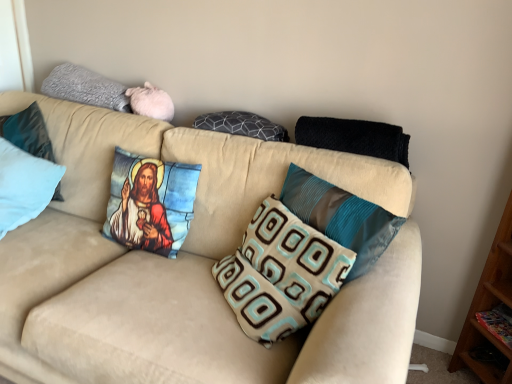
Image resolution: width=512 pixels, height=384 pixels. Describe the element at coordinates (341, 217) in the screenshot. I see `teal fabric pillow at center, which is the second pillow in right-to-left order` at that location.

What do you see at coordinates (29, 132) in the screenshot? I see `light blue fabric pillow at left, which is the 2th pillow from left to right` at bounding box center [29, 132].

The image size is (512, 384). What do you see at coordinates (150, 203) in the screenshot? I see `printed fabric pillow with jesus image at center, positioned as the fifth pillow in right-to-left order` at bounding box center [150, 203].

The width and height of the screenshot is (512, 384). What do you see at coordinates (281, 274) in the screenshot?
I see `brown and teal patterned pillow at center, the 3th pillow in the right-to-left sequence` at bounding box center [281, 274].

In order to face light blue fabric pillow at left, the first pillow from the left, should I rotate leftwards or rightwards?

Turn left approximately 31.438 degrees to face it.

At what (x,y) coordinates should I click in order to perform the action: click on dark gray textured pillow at center, the 5th pillow positioned from the left. Please return your answer as a coordinate pair (x, y). Looking at the image, I should click on (242, 125).

Image resolution: width=512 pixels, height=384 pixels. In order to click on teal fabric pillow at center, which is the second pillow in right-to-left order in this screenshot , I will do `click(341, 217)`.

Can you tell me how much beige fabric couch at center and printed fabric pillow with jesus image at center, the 4th pillow viewed from the left, differ in facing direction?

They differ by 0.864 degrees in their facing directions.

Is beige fabric couch at center taller than printed fabric pillow with jesus image at center, positioned as the fifth pillow in right-to-left order?

Yes.

Does point (99, 247) come farther from viewer compared to point (186, 217)?

Yes, it is.

Based on the photo, is beige fabric couch at center far away from printed fabric pillow with jesus image at center, positioned as the fifth pillow in right-to-left order?

That's not correct — beige fabric couch at center is a little close to printed fabric pillow with jesus image at center, positioned as the fifth pillow in right-to-left order.

Is teal fabric pillow at center, which is the second pillow in right-to-left order, facing towards light blue fabric pillow at left, which appears as the seventh pillow when viewed from the right?

No.

Who is smaller, teal fabric pillow at center, the seventh pillow in the left-to-right sequence, or light blue fabric pillow at left, which is the 2th pillow from left to right?

teal fabric pillow at center, the seventh pillow in the left-to-right sequence, is smaller.

At what (x,y) coordinates should I click in order to perform the action: click on pillow that is the 3rd one when counting downward from the light blue fabric pillow at left, which appears as the seventh pillow when viewed from the right (from the image's perspective). Please return your answer as a coordinate pair (x, y). The image size is (512, 384). Looking at the image, I should click on (341, 217).

Which is correct: teal fabric pillow at center, the seventh pillow in the left-to-right sequence, is inside light blue fabric pillow at left, which appears as the seventh pillow when viewed from the right, or outside of it?

teal fabric pillow at center, the seventh pillow in the left-to-right sequence, exists outside the volume of light blue fabric pillow at left, which appears as the seventh pillow when viewed from the right.

Is light blue fabric pillow at left, which appears as the seventh pillow when viewed from the right, oriented towards light blue fabric pillow at left, the 8th pillow when ordered from right to left?

Yes, light blue fabric pillow at left, which appears as the seventh pillow when viewed from the right, is turned towards light blue fabric pillow at left, the 8th pillow when ordered from right to left.

From a real-world perspective, between light blue fabric pillow at left, which appears as the seventh pillow when viewed from the right, and light blue fabric pillow at left, the first pillow from the left, who is vertically higher?

From a 3D spatial view, light blue fabric pillow at left, which appears as the seventh pillow when viewed from the right, is above.

Visually, is light blue fabric pillow at left, which appears as the seventh pillow when viewed from the right, positioned to the left or to the right of light blue fabric pillow at left, the first pillow from the left?

In the image, light blue fabric pillow at left, which appears as the seventh pillow when viewed from the right, appears on the right side of light blue fabric pillow at left, the first pillow from the left.

Is point (362, 240) positioned before point (145, 180)?

Yes, it is.

Can you confirm if teal fabric pillow at center, the seventh pillow in the left-to-right sequence, is thinner than printed fabric pillow with jesus image at center, positioned as the fifth pillow in right-to-left order?

Correct, the width of teal fabric pillow at center, the seventh pillow in the left-to-right sequence, is less than that of printed fabric pillow with jesus image at center, positioned as the fifth pillow in right-to-left order.

Considering the relative sizes of teal fabric pillow at center, which is the second pillow in right-to-left order, and printed fabric pillow with jesus image at center, the 4th pillow viewed from the left, in the image provided, is teal fabric pillow at center, which is the second pillow in right-to-left order, shorter than printed fabric pillow with jesus image at center, the 4th pillow viewed from the left,?

No.

Looking at this image, is teal fabric pillow at center, the seventh pillow in the left-to-right sequence, situated inside printed fabric pillow with jesus image at center, positioned as the fifth pillow in right-to-left order, or outside?

teal fabric pillow at center, the seventh pillow in the left-to-right sequence, lies outside printed fabric pillow with jesus image at center, positioned as the fifth pillow in right-to-left order.

There is a printed fabric pillow with jesus image at center, positioned as the fifth pillow in right-to-left order. Where is `the 2nd pillow above it (from the image's perspective)`? This screenshot has height=384, width=512. the 2nd pillow above it (from the image's perspective) is located at coordinates (29, 132).

Could you measure the distance between light blue fabric pillow at left, which appears as the seventh pillow when viewed from the right, and printed fabric pillow with jesus image at center, the 4th pillow viewed from the left?

light blue fabric pillow at left, which appears as the seventh pillow when viewed from the right, is 53.24 centimeters away from printed fabric pillow with jesus image at center, the 4th pillow viewed from the left.

Relative to printed fabric pillow with jesus image at center, the 4th pillow viewed from the left, is light blue fabric pillow at left, which is the 2th pillow from left to right, in front or behind?

Visually, light blue fabric pillow at left, which is the 2th pillow from left to right, is located behind printed fabric pillow with jesus image at center, the 4th pillow viewed from the left.

Which is in front, point (41, 140) or point (184, 207)?

The point (184, 207) is closer to the camera.

Are brown and teal patterned pillow at center, positioned as the sixth pillow in left-to-right order, and light blue fabric pillow at left, the 8th pillow when ordered from right to left, making contact?

No, brown and teal patterned pillow at center, positioned as the sixth pillow in left-to-right order, is not with light blue fabric pillow at left, the 8th pillow when ordered from right to left.

Can you confirm if brown and teal patterned pillow at center, positioned as the sixth pillow in left-to-right order, is wider than light blue fabric pillow at left, the first pillow from the left?

No.

Measure the distance from brown and teal patterned pillow at center, positioned as the sixth pillow in left-to-right order, to light blue fabric pillow at left, the first pillow from the left.

A distance of 3.53 feet exists between brown and teal patterned pillow at center, positioned as the sixth pillow in left-to-right order, and light blue fabric pillow at left, the first pillow from the left.

From a real-world perspective, is brown and teal patterned pillow at center, the 3th pillow in the right-to-left sequence, physically located above or below light blue fabric pillow at left, the 8th pillow when ordered from right to left?

brown and teal patterned pillow at center, the 3th pillow in the right-to-left sequence, is above light blue fabric pillow at left, the 8th pillow when ordered from right to left.

Is dark gray textured pillow at center, the 5th pillow positioned from the left, outside of light blue fabric pillow at left, which is the 2th pillow from left to right?

That's correct, dark gray textured pillow at center, the 5th pillow positioned from the left, is outside of light blue fabric pillow at left, which is the 2th pillow from left to right.

Identify the location of pillow that is the 3rd one when counting leftward from the dark gray textured pillow at center, which is the 4th pillow from right to left. The image size is (512, 384). (29, 132).

Is dark gray textured pillow at center, the 5th pillow positioned from the left, in front of light blue fabric pillow at left, which is the 2th pillow from left to right?

Yes, it is in front of light blue fabric pillow at left, which is the 2th pillow from left to right.

From a real-world perspective, who is located lower, dark gray textured pillow at center, which is the 4th pillow from right to left, or light blue fabric pillow at left, which appears as the seventh pillow when viewed from the right?

In real-world perspective, light blue fabric pillow at left, which appears as the seventh pillow when viewed from the right, is lower.

Locate an element on the screen. studio couch in front of the printed fabric pillow with jesus image at center, positioned as the fifth pillow in right-to-left order is located at coordinates (189, 267).

From the image's perspective, which pillow is the 3rd one above the teal fabric pillow at center, the seventh pillow in the left-to-right sequence? Please provide its 2D coordinates.

[(29, 132)]

Looking at the image, which one is located closer to printed fabric pillow with jesus image at center, the 4th pillow viewed from the left, teal fabric pillow at center, which is the second pillow in right-to-left order, or brown and teal patterned pillow at center, the 3th pillow in the right-to-left sequence?

brown and teal patterned pillow at center, the 3th pillow in the right-to-left sequence, lies closer to printed fabric pillow with jesus image at center, the 4th pillow viewed from the left, than the other object.

From the picture: When comparing their distances from light blue fabric pillow at left, the first pillow from the left, does beige fabric couch at center or black knitted blanket at upper right, arranged as the 1th pillow when viewed from the right, seem closer?

Among the two, beige fabric couch at center is located nearer to light blue fabric pillow at left, the first pillow from the left.

Looking at the image, which one is located closer to light blue fabric pillow at left, which appears as the seventh pillow when viewed from the right, beige fabric couch at center or gray fuzzy pillow at upper left, the 6th pillow when ordered from right to left?

Based on the image, gray fuzzy pillow at upper left, the 6th pillow when ordered from right to left, appears to be nearer to light blue fabric pillow at left, which appears as the seventh pillow when viewed from the right.

From the image, which object appears to be nearer to brown and teal patterned pillow at center, the 3th pillow in the right-to-left sequence, black knitted blanket at upper right, arranged as the 8th pillow when viewed from the left, or light blue fabric pillow at left, the 8th pillow when ordered from right to left?

black knitted blanket at upper right, arranged as the 8th pillow when viewed from the left, is closer to brown and teal patterned pillow at center, the 3th pillow in the right-to-left sequence.

Based on their spatial positions, is gray fuzzy pillow at upper left, marked as the 3th pillow in a left-to-right arrangement, or light blue fabric pillow at left, which is the 2th pillow from left to right, further from beige fabric couch at center?

light blue fabric pillow at left, which is the 2th pillow from left to right, is further to beige fabric couch at center.

When comparing their distances from gray fuzzy pillow at upper left, marked as the 3th pillow in a left-to-right arrangement, does light blue fabric pillow at left, which is the 2th pillow from left to right, or light blue fabric pillow at left, the 8th pillow when ordered from right to left, seem closer?

light blue fabric pillow at left, which is the 2th pillow from left to right, is positioned closer to the anchor gray fuzzy pillow at upper left, marked as the 3th pillow in a left-to-right arrangement.

From the image, which object appears to be nearer to brown and teal patterned pillow at center, the 3th pillow in the right-to-left sequence, beige fabric couch at center or dark gray textured pillow at center, the 5th pillow positioned from the left?

The object closer to brown and teal patterned pillow at center, the 3th pillow in the right-to-left sequence, is beige fabric couch at center.

From the image, which object appears to be nearer to printed fabric pillow with jesus image at center, the 4th pillow viewed from the left, brown and teal patterned pillow at center, the 3th pillow in the right-to-left sequence, or dark gray textured pillow at center, which is the 4th pillow from right to left?

dark gray textured pillow at center, which is the 4th pillow from right to left, lies closer to printed fabric pillow with jesus image at center, the 4th pillow viewed from the left, than the other object.

Where is `studio couch between light blue fabric pillow at left, the first pillow from the left, and dark gray textured pillow at center, the 5th pillow positioned from the left, from left to right`? The width and height of the screenshot is (512, 384). studio couch between light blue fabric pillow at left, the first pillow from the left, and dark gray textured pillow at center, the 5th pillow positioned from the left, from left to right is located at coordinates (189, 267).

Where is `studio couch between light blue fabric pillow at left, the 8th pillow when ordered from right to left, and brown and teal patterned pillow at center, positioned as the sixth pillow in left-to-right order, in the horizontal direction`? This screenshot has width=512, height=384. studio couch between light blue fabric pillow at left, the 8th pillow when ordered from right to left, and brown and teal patterned pillow at center, positioned as the sixth pillow in left-to-right order, in the horizontal direction is located at coordinates (189, 267).

You are a GUI agent. You are given a task and a screenshot of the screen. Output one action in this format:
    pyautogui.click(x=<x>, y=<y>)
    Task: Click on the studio couch located between light blue fabric pillow at left, which appears as the seventh pillow when viewed from the right, and brown and teal patterned pillow at center, the 3th pillow in the right-to-left sequence, in the left-right direction
    The width and height of the screenshot is (512, 384).
    Given the screenshot: What is the action you would take?
    pyautogui.click(x=189, y=267)

Locate an element on the screen. studio couch situated between light blue fabric pillow at left, which is the 2th pillow from left to right, and teal fabric pillow at center, which is the second pillow in right-to-left order, from left to right is located at coordinates (189, 267).